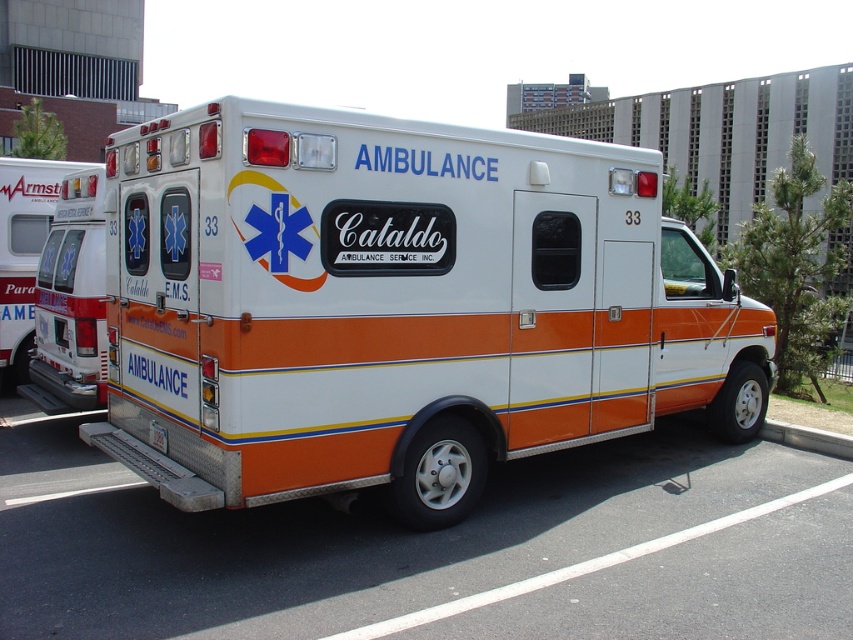
You are a delivery person trying to read the license plate of the ambulance. You are standing in front of the white glossy ambulance at center. Can you see the white plastic license plate at lower center from your current position?

The white glossy ambulance at center is in front of the white plastic license plate at lower center, so the ambulance is blocking your view of the license plate. You cannot see the white plastic license plate at lower center from your current position.

You are a delivery person trying to park your van in the parking lot where the white glossy ambulance at center and the white plastic license plate at lower center are located. From your perspective facing the ambulance, which object is more to the right?

The white glossy ambulance at center is positioned on the right side of the white plastic license plate at lower center, so from your perspective facing the ambulance, the white glossy ambulance at center is more to the right.